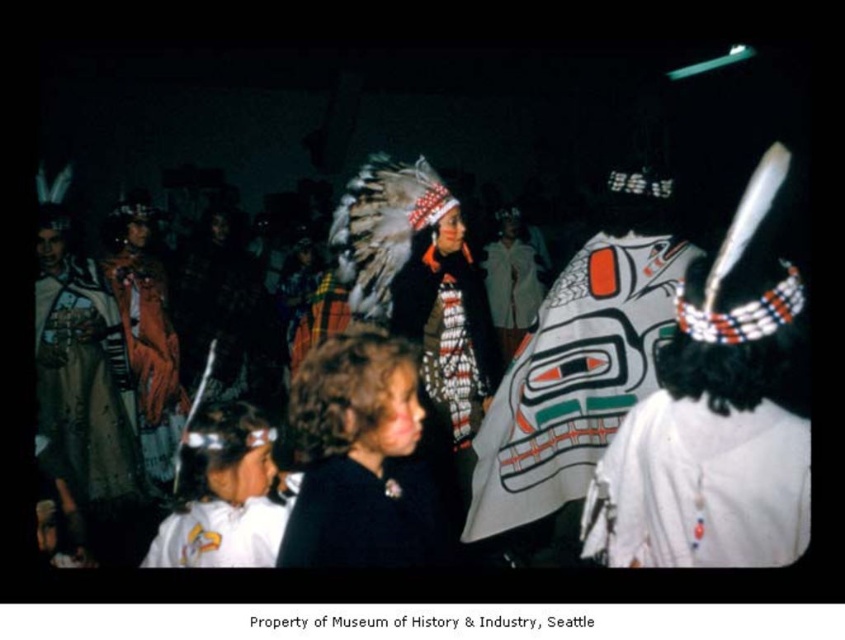
Question: Can you confirm if white fabric mask at center is smaller than white matte headdress at lower left?

Choices:
 (A) no
 (B) yes

Answer: (A)

Question: Estimate the real-world distances between objects in this image. Which object is farther from the white matte headdress at lower left?

Choices:
 (A) velvet black robe at center
 (B) textured brown robe at left
 (C) dark brown hair at center
 (D) white fabric with beads at center

Answer: (B)

Question: Which object appears farthest from the camera in this image?

Choices:
 (A) white matte headdress at lower left
 (B) textured brown robe at left
 (C) white fabric mask at center

Answer: (B)

Question: Does white fabric with beads at center have a smaller size compared to white matte shirt at lower left?

Choices:
 (A) yes
 (B) no

Answer: (B)

Question: Which of the following is the closest to the observer?

Choices:
 (A) white fabric with beads at center
 (B) velvet black robe at center
 (C) dark brown hair at center
 (D) textured brown robe at left

Answer: (A)

Question: Is textured brown robe at left wider than white matte headdress at lower left?

Choices:
 (A) yes
 (B) no

Answer: (B)